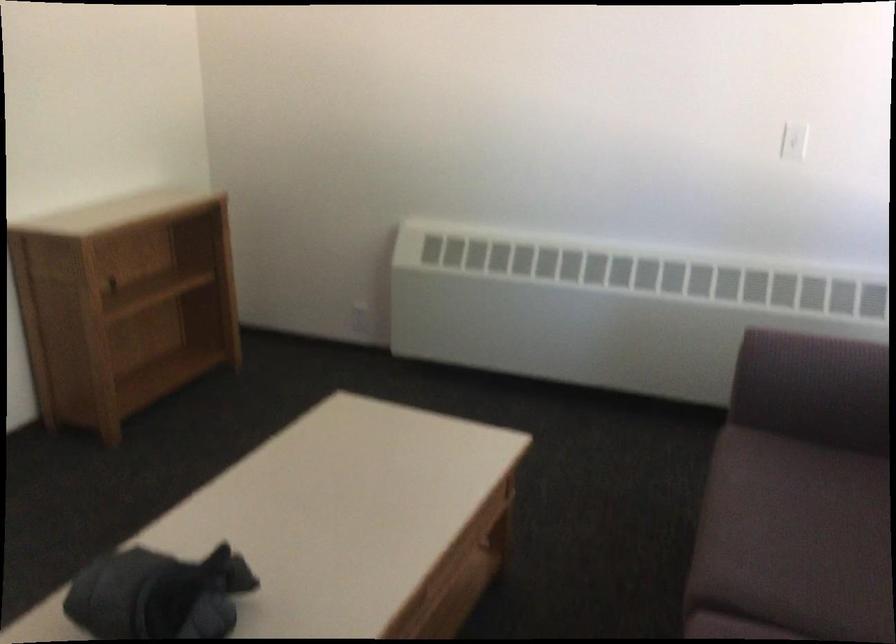
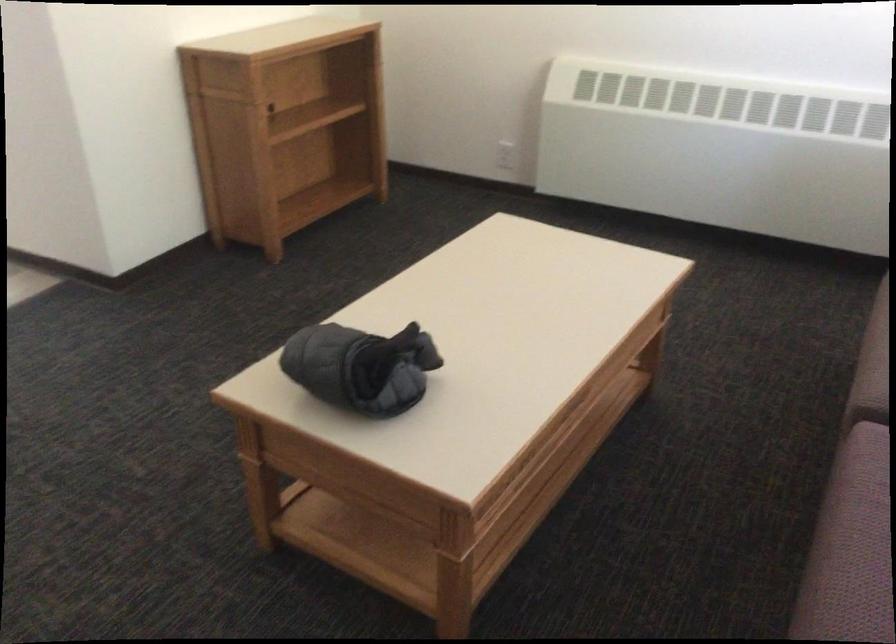
In the second image, find the point that corresponds to point (362, 317) in the first image.

(505, 155)